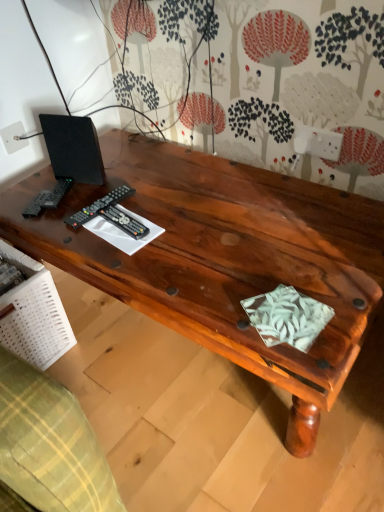
You are a GUI agent. You are given a task and a screenshot of the screen. Output one action in this format:
    pyautogui.click(x=<x>, y=<y>)
    Task: Click on the blank space to the left of black plastic remote at left, which appears as the 1th control when viewed from the left
    This screenshot has height=512, width=384.
    Given the screenshot: What is the action you would take?
    pyautogui.click(x=46, y=212)